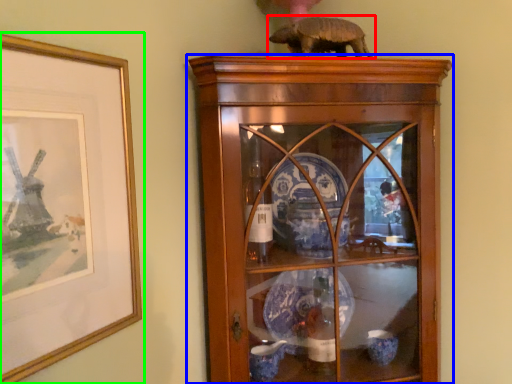
Question: Considering the real-world distances, which object is closest to animal (highlighted by a red box)? shelf (highlighted by a blue box) or picture frame (highlighted by a green box).

Choices:
 (A) shelf
 (B) picture frame

Answer: (A)